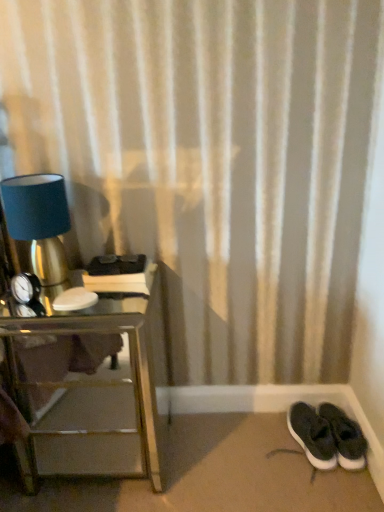
Question: Considering the relative sizes of silver mirrored nightstand at left and black suede sneakers at lower right in the image provided, is silver mirrored nightstand at left bigger than black suede sneakers at lower right?

Choices:
 (A) yes
 (B) no

Answer: (A)

Question: Are silver mirrored nightstand at left and black suede sneakers at lower right making contact?

Choices:
 (A) yes
 (B) no

Answer: (B)

Question: Is silver mirrored nightstand at left outside of black suede sneakers at lower right?

Choices:
 (A) yes
 (B) no

Answer: (A)

Question: From a real-world perspective, is silver mirrored nightstand at left positioned under black suede sneakers at lower right based on gravity?

Choices:
 (A) no
 (B) yes

Answer: (A)

Question: Is silver mirrored nightstand at left aimed at black suede sneakers at lower right?

Choices:
 (A) yes
 (B) no

Answer: (B)

Question: Is matte blue lampshade at left in front of or behind black suede sneakers at lower right in the image?

Choices:
 (A) front
 (B) behind

Answer: (A)

Question: From the image's perspective, is matte blue lampshade at left located above or below black suede sneakers at lower right?

Choices:
 (A) below
 (B) above

Answer: (B)

Question: Based on their sizes in the image, would you say matte blue lampshade at left is bigger or smaller than black suede sneakers at lower right?

Choices:
 (A) big
 (B) small

Answer: (A)

Question: Is matte blue lampshade at left inside or outside of black suede sneakers at lower right?

Choices:
 (A) outside
 (B) inside

Answer: (A)

Question: In terms of width, does silver mirrored nightstand at left look wider or thinner when compared to matte blue lampshade at left?

Choices:
 (A) wide
 (B) thin

Answer: (A)

Question: Relative to matte blue lampshade at left, is silver mirrored nightstand at left in front or behind?

Choices:
 (A) front
 (B) behind

Answer: (A)

Question: Would you say silver mirrored nightstand at left is to the left or to the right of matte blue lampshade at left in the picture?

Choices:
 (A) right
 (B) left

Answer: (A)

Question: From the image's perspective, is silver mirrored nightstand at left positioned above or below matte blue lampshade at left?

Choices:
 (A) above
 (B) below

Answer: (B)

Question: Does point (336, 459) appear closer or farther from the camera than point (52, 197)?

Choices:
 (A) closer
 (B) farther

Answer: (B)

Question: In terms of height, does black suede sneakers at lower right look taller or shorter compared to matte blue lampshade at left?

Choices:
 (A) tall
 (B) short

Answer: (B)